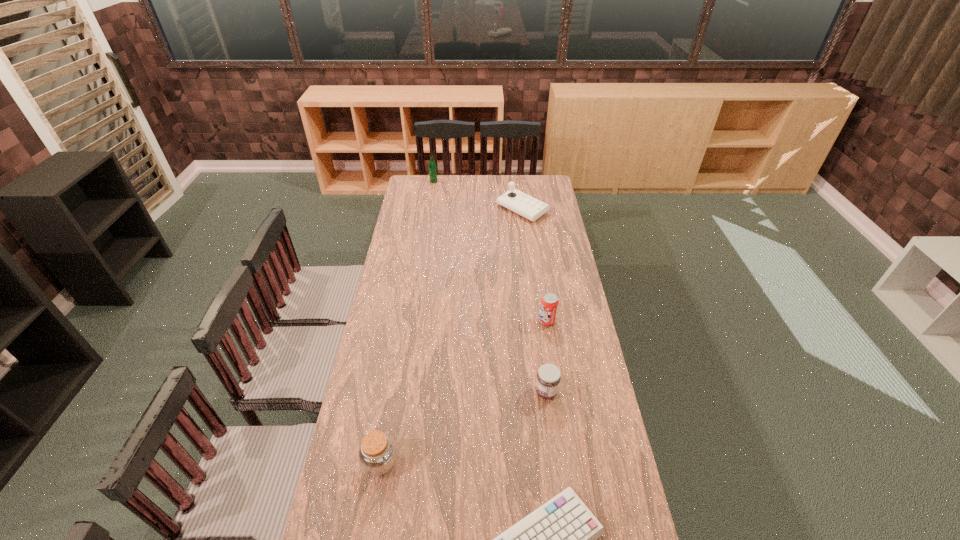
Find the location of a particular element. This screenshot has height=540, width=960. jam at the right edge is located at coordinates (548, 379).

You are a GUI agent. You are given a task and a screenshot of the screen. Output one action in this format:
    pyautogui.click(x=<x>, y=<y>)
    Task: Click on the object that is at the far left corner
    
    Given the screenshot: What is the action you would take?
    pyautogui.click(x=432, y=167)

Where is `object located at the far right corner`? The height and width of the screenshot is (540, 960). object located at the far right corner is located at coordinates (527, 206).

In the image, there is a desktop. Where is `free space at the far edge`? The height and width of the screenshot is (540, 960). free space at the far edge is located at coordinates (520, 188).

In the image, there is a desktop. At what (x,y) coordinates should I click in order to perform the action: click on vacant space at the left edge. Please return your answer as a coordinate pair (x, y). The image size is (960, 540). Looking at the image, I should click on (408, 206).

This screenshot has width=960, height=540. I want to click on vacant space at the right edge of the desktop, so click(562, 271).

This screenshot has width=960, height=540. What are the coordinates of `free location at the far left corner` in the screenshot? It's located at (410, 188).

Image resolution: width=960 pixels, height=540 pixels. I want to click on empty location between the third nearest object and the third farthest object, so click(546, 356).

The height and width of the screenshot is (540, 960). What are the coordinates of `free spot between the soda can and the bottle` in the screenshot? It's located at (491, 251).

Find the location of a particular element. The image size is (960, 540). unoccupied position between the second farthest object and the jam is located at coordinates (535, 301).